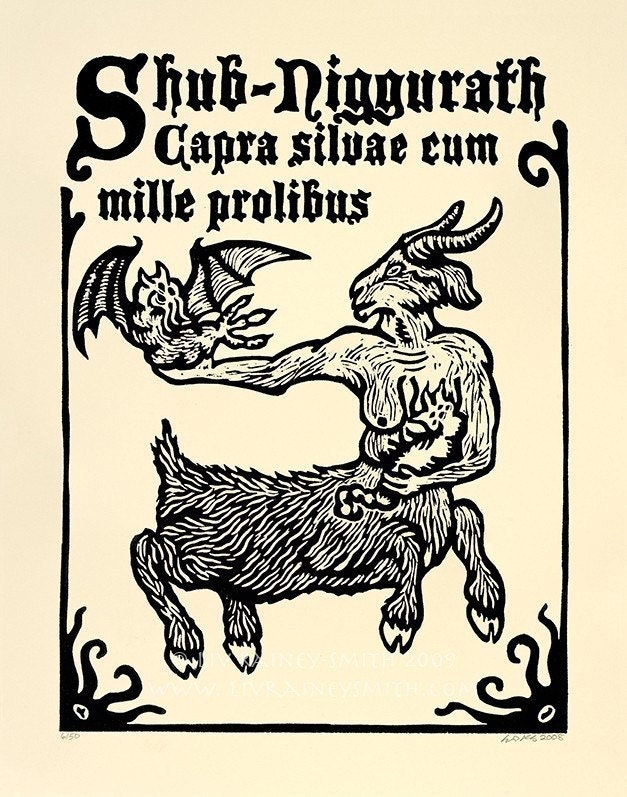
What are the coordinates of `corner` in the screenshot? It's located at (565, 731), (61, 728).